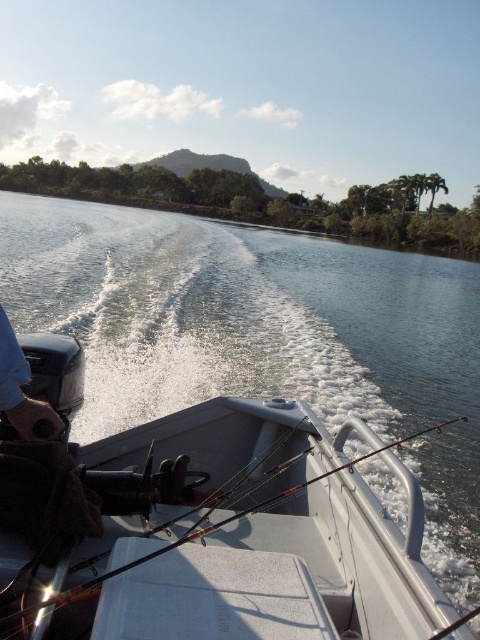
Is white plastic boat at center behind blue fabric glove at lower left?

No, white plastic boat at center is closer to the viewer.

Identify the location of white plastic boat at center. The image size is (480, 640). (242, 541).